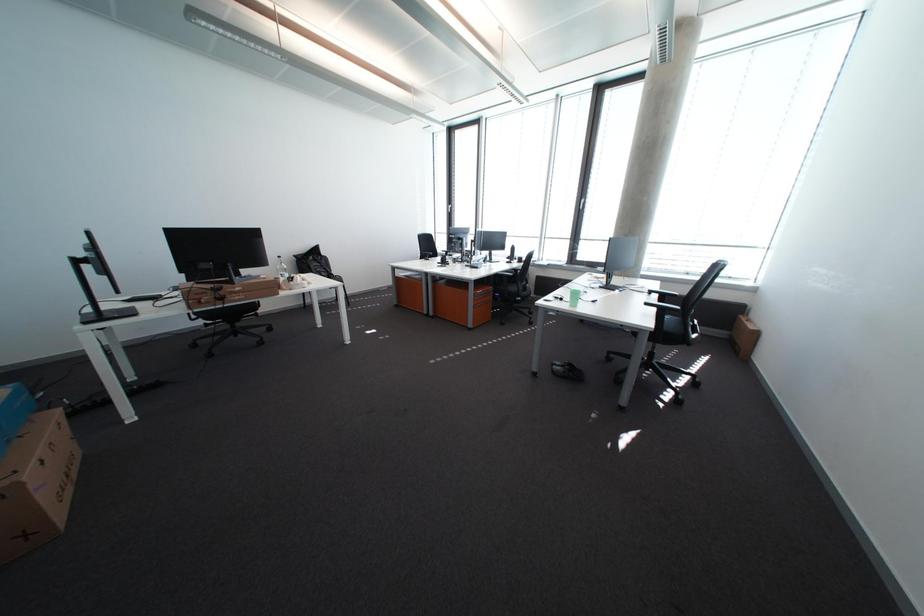
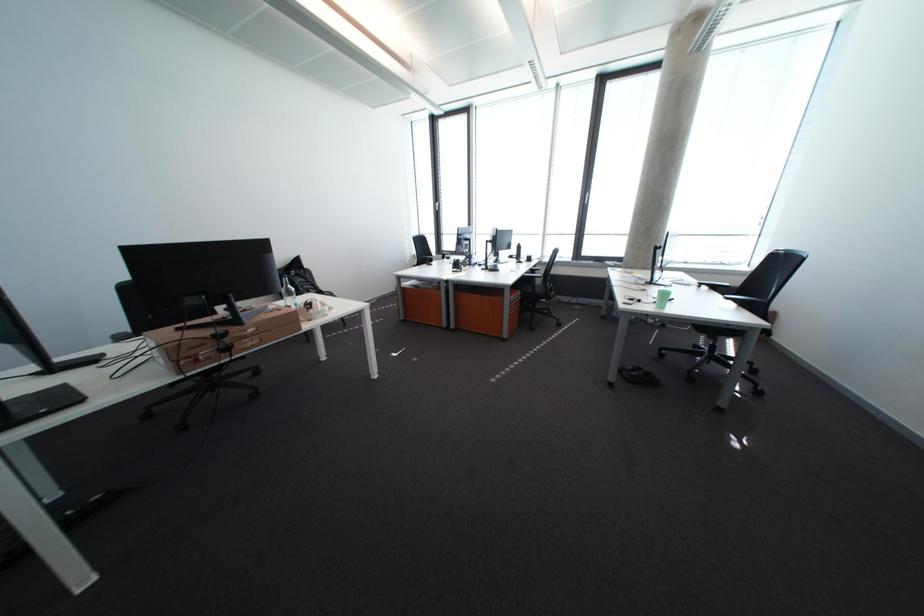
In a continuous first-person perspective shot, in which direction is the camera moving?

The cameraman walked toward left, forward.